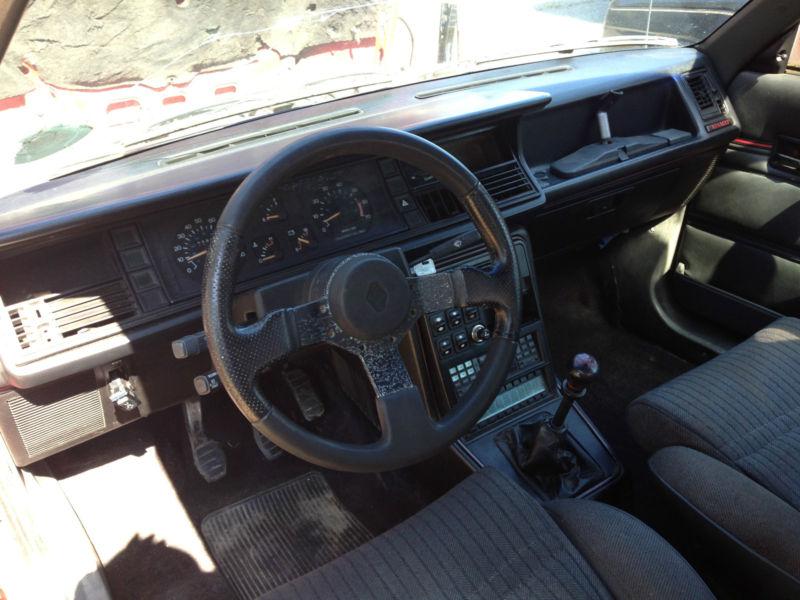
The height and width of the screenshot is (600, 800). I want to click on floor mat, so click(278, 547).